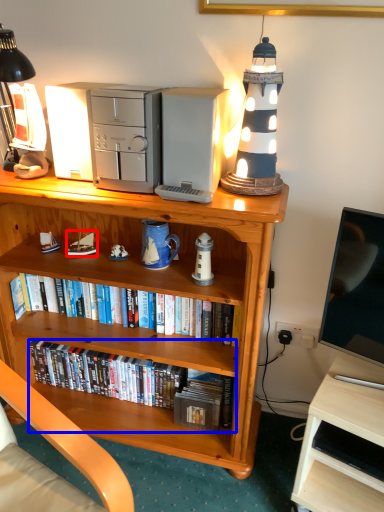
Question: Which object is further to the camera taking this photo, toy (highlighted by a red box) or book (highlighted by a blue box)?

Choices:
 (A) toy
 (B) book

Answer: (B)